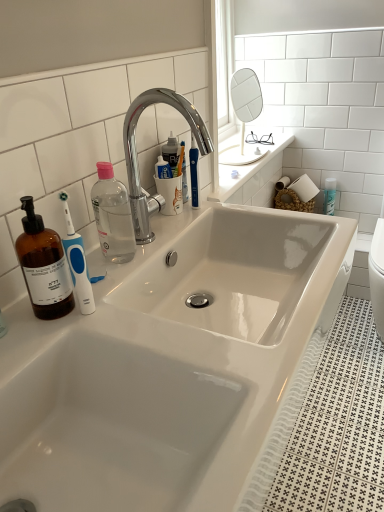
What is the approximate height of white glossy mirror at upper center?

white glossy mirror at upper center is 13.60 inches in height.

Locate an element on the screen. This screenshot has width=384, height=512. white glossy mirror at upper center is located at coordinates (243, 110).

Describe the element at coordinates (243, 110) in the screenshot. I see `white glossy mirror at upper center` at that location.

At what (x,y) coordinates should I click in order to perform the action: click on chrome/metallic faucet at upper center. Please return your answer as a coordinate pair (x, y). Image resolution: width=384 pixels, height=512 pixels. Looking at the image, I should click on (137, 158).

This screenshot has width=384, height=512. What do you see at coordinates (137, 158) in the screenshot?
I see `chrome/metallic faucet at upper center` at bounding box center [137, 158].

Identify the location of white glossy mirror at upper center. The height and width of the screenshot is (512, 384). [x=243, y=110].

Is white glossy mirror at upper center to the left of chrome/metallic faucet at upper center from the viewer's perspective?

Incorrect, white glossy mirror at upper center is not on the left side of chrome/metallic faucet at upper center.

Is white glossy mirror at upper center positioned before chrome/metallic faucet at upper center?

No, white glossy mirror at upper center is behind chrome/metallic faucet at upper center.

Is point (222, 164) closer or farther from the camera than point (194, 110)?

Point (222, 164).

From the image's perspective, would you say white glossy mirror at upper center is positioned over chrome/metallic faucet at upper center?

Yes, from the image's perspective, white glossy mirror at upper center is over chrome/metallic faucet at upper center.

From a real-world perspective, is white glossy mirror at upper center over chrome/metallic faucet at upper center?

No.

Between white glossy mirror at upper center and chrome/metallic faucet at upper center, which one has smaller width?

chrome/metallic faucet at upper center is thinner.

Can you confirm if white glossy mirror at upper center is shorter than chrome/metallic faucet at upper center?

No, white glossy mirror at upper center is not shorter than chrome/metallic faucet at upper center.

In terms of size, does white glossy mirror at upper center appear bigger or smaller than chrome/metallic faucet at upper center?

Clearly, white glossy mirror at upper center is larger in size than chrome/metallic faucet at upper center.

In the scene shown: Is white glossy mirror at upper center inside or outside of chrome/metallic faucet at upper center?

white glossy mirror at upper center is not enclosed by chrome/metallic faucet at upper center.

Are white glossy mirror at upper center and chrome/metallic faucet at upper center making contact?

white glossy mirror at upper center and chrome/metallic faucet at upper center are clearly separated.

Is white glossy mirror at upper center looking in the opposite direction of chrome/metallic faucet at upper center?

white glossy mirror at upper center does not have its back to chrome/metallic faucet at upper center.

How different are the orientations of white glossy mirror at upper center and chrome/metallic faucet at upper center in degrees?

The angular difference between white glossy mirror at upper center and chrome/metallic faucet at upper center is 0.922 degrees.

Identify the location of mirror that is behind the chrome/metallic faucet at upper center. This screenshot has width=384, height=512. (243, 110).

Is chrome/metallic faucet at upper center at the left side of white glossy mirror at upper center?

Yes.

Is chrome/metallic faucet at upper center behind white glossy mirror at upper center?

No, chrome/metallic faucet at upper center is closer to the camera.

Between point (131, 177) and point (237, 82), which one is positioned behind?

Point (237, 82)

From the image's perspective, which one is positioned higher, chrome/metallic faucet at upper center or white glossy mirror at upper center?

white glossy mirror at upper center, from the image's perspective.

From the picture: From a real-world perspective, which is physically above, chrome/metallic faucet at upper center or white glossy mirror at upper center?

chrome/metallic faucet at upper center, from a real-world perspective.

Which of these two, chrome/metallic faucet at upper center or white glossy mirror at upper center, is thinner?

With smaller width is chrome/metallic faucet at upper center.

In the scene shown: Can you confirm if chrome/metallic faucet at upper center is shorter than white glossy mirror at upper center?

Yes, chrome/metallic faucet at upper center is shorter than white glossy mirror at upper center.

Considering the sizes of objects chrome/metallic faucet at upper center and white glossy mirror at upper center in the image provided, who is bigger, chrome/metallic faucet at upper center or white glossy mirror at upper center?

With larger size is white glossy mirror at upper center.

Is white glossy mirror at upper center completely or partially inside chrome/metallic faucet at upper center?

Actually, white glossy mirror at upper center is outside chrome/metallic faucet at upper center.

Is the surface of chrome/metallic faucet at upper center in direct contact with white glossy mirror at upper center?

chrome/metallic faucet at upper center and white glossy mirror at upper center are not in contact.

Based on the photo, is chrome/metallic faucet at upper center facing towards white glossy mirror at upper center?

No, chrome/metallic faucet at upper center does not turn towards white glossy mirror at upper center.

How much distance is there between chrome/metallic faucet at upper center and white glossy mirror at upper center?

chrome/metallic faucet at upper center and white glossy mirror at upper center are 1.17 meters apart from each other.

This screenshot has width=384, height=512. What are the coordinates of `tap below the white glossy mirror at upper center (from the image's perspective)` in the screenshot? It's located at (137, 158).

There is a white glossy mirror at upper center. Where is `tap above it (from a real-world perspective)`? The width and height of the screenshot is (384, 512). tap above it (from a real-world perspective) is located at coordinates (137, 158).

Locate an element on the screen. The height and width of the screenshot is (512, 384). mirror below the chrome/metallic faucet at upper center (from a real-world perspective) is located at coordinates (243, 110).